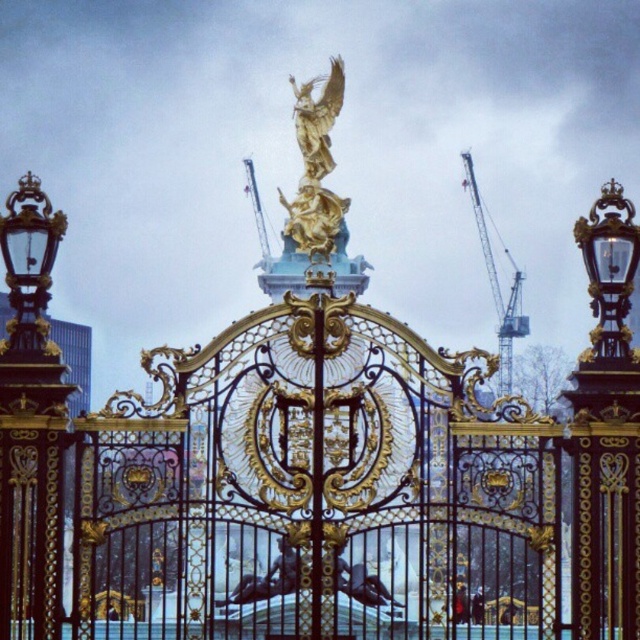
You are standing in front of the grand gate and want to take a photo. There are two points marked on the gate at coordinates point (x=10, y=230) and point (x=593, y=316). Which point will appear larger in your photo?

Point (x=10, y=230) is closer to the camera than point (x=593, y=316), so it will appear larger in the photo.

You are a photographer standing in front of the gold ornate gate at center and the metallic gray crane at upper right. You want to capture a photo where both objects are visible. Which object should you position closer to the bottom of the frame to include both in the shot?

The gold ornate gate at center is below the metallic gray crane at upper right, so you should position the gold ornate gate at center closer to the bottom of the frame to include both in the shot.